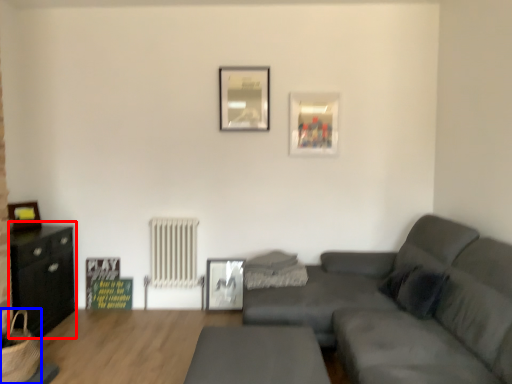
Question: Which object is closer to the camera taking this photo, entertainment center (highlighted by a red box) or basket (highlighted by a blue box)?

Choices:
 (A) entertainment center
 (B) basket

Answer: (B)